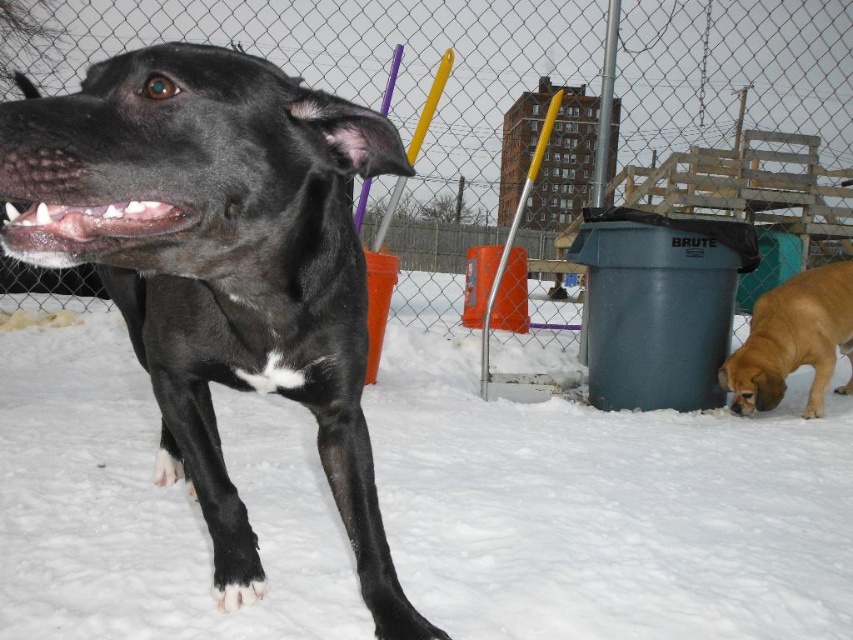
You are standing in the snowy scene and want to place a small red flag exactly where the white fluffy snow at lower left is located. According to the coordinates provided, where should you place the flag?

You should place the small red flag at the coordinates point (607, 509) where the white fluffy snow at lower left is located.

You are a photographer taking a picture of the black glossy dog at left and the white fluffy snow at lower left. Where should you position your camera to ensure both subjects are in frame?

Position the camera so it captures the black glossy dog at left while ensuring the white fluffy snow at lower left is visible beneath it, as the snow is positioned under the dog.